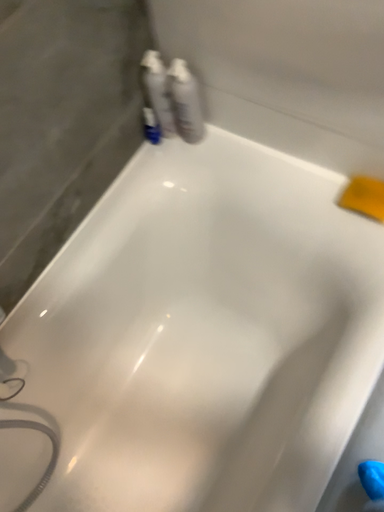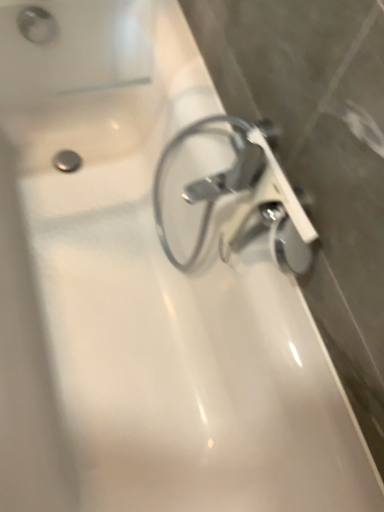
Question: How did the camera likely rotate when shooting the video?

Choices:
 (A) rotated downward
 (B) rotated upward

Answer: (B)